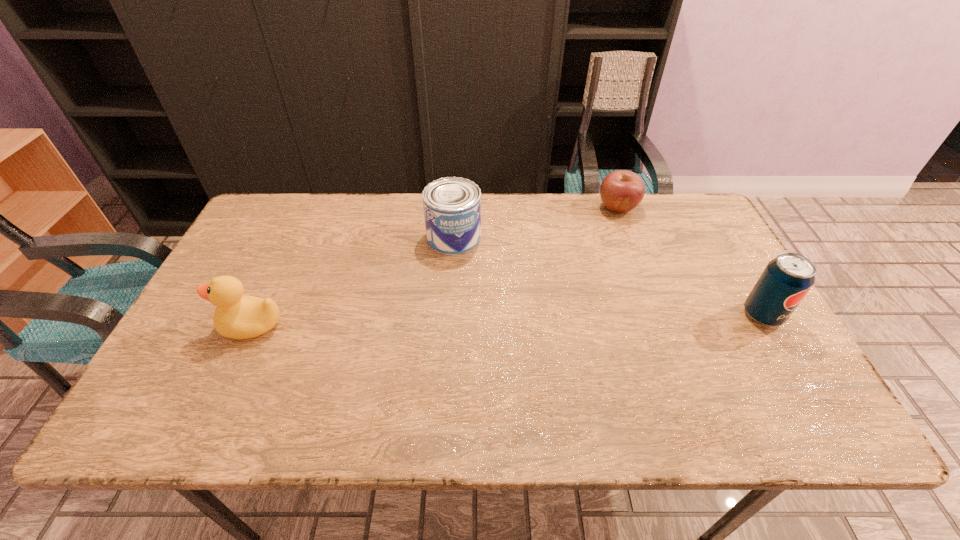
Identify the location of the leftmost object. (237, 316).

Locate an element on the screen. the rightmost object is located at coordinates (785, 281).

You are a GUI agent. You are given a task and a screenshot of the screen. Output one action in this format:
    pyautogui.click(x=<x>, y=<y>)
    Task: Click on the shortest object
    This screenshot has height=540, width=960.
    Given the screenshot: What is the action you would take?
    pyautogui.click(x=621, y=191)

Find the location of a particular element. the second object from right to left is located at coordinates (621, 191).

Find the location of a particular element. can is located at coordinates (452, 205).

Where is `the second object from left to right`? The image size is (960, 540). the second object from left to right is located at coordinates (452, 205).

This screenshot has height=540, width=960. I want to click on vacant space located 0.350m on the left of the soda can, so click(606, 315).

At what (x,y) coordinates should I click in order to perform the action: click on free point located on the side of the farthest object with the unique marking. Please return your answer as a coordinate pair (x, y). Looking at the image, I should click on (584, 262).

Locate an element on the screen. This screenshot has width=960, height=540. vacant area located on the side of the farthest object with the unique marking is located at coordinates (562, 298).

The width and height of the screenshot is (960, 540). I want to click on free space located on the side of the farthest object with the unique marking, so click(565, 291).